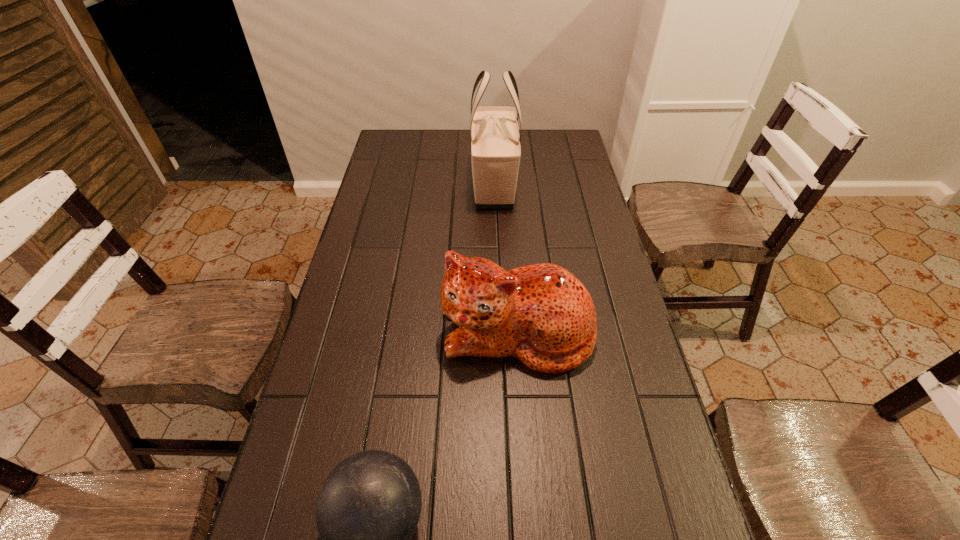
Find the location of `free space at the far right corner of the desktop`. free space at the far right corner of the desktop is located at coordinates (540, 129).

I want to click on unoccupied area between the shopping bag and the second shortest object, so point(505,258).

At what (x,y) coordinates should I click in order to perform the action: click on vacant region between the farthest object and the second tallest object. Please return your answer as a coordinate pair (x, y). Image resolution: width=960 pixels, height=540 pixels. Looking at the image, I should click on (505, 258).

In order to click on vacant area that lies between the shopping bag and the second tallest object in this screenshot , I will do `click(505, 258)`.

Select which object appears as the closest to the leftmost object. Please provide its 2D coordinates. Your answer should be formatted as a tuple, i.e. [(x, y)], where the tuple contains the x and y coordinates of a point satisfying the conditions above.

[(542, 314)]

Locate an element on the screen. object that is the second closest to the cat is located at coordinates (494, 135).